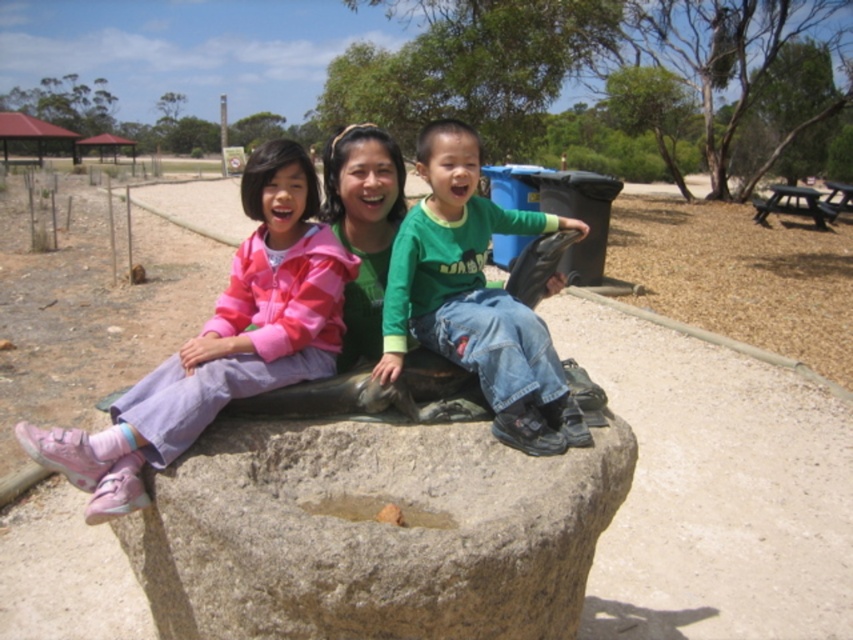
Which is below, pink fleece jacket at left or green cotton shirt at center?

pink fleece jacket at left is below.

Is pink fleece jacket at left bigger than green cotton shirt at center?

Correct, pink fleece jacket at left is larger in size than green cotton shirt at center.

Where is `pink fleece jacket at left`? This screenshot has height=640, width=853. pink fleece jacket at left is located at coordinates (222, 340).

Can you confirm if smooth stone boulder at center is positioned above pink fleece jacket at left?

Actually, smooth stone boulder at center is below pink fleece jacket at left.

Can you confirm if smooth stone boulder at center is smaller than pink fleece jacket at left?

Correct, smooth stone boulder at center occupies less space than pink fleece jacket at left.

Does point (552, 525) come behind point (322, 266)?

No.

Identify the location of smooth stone boulder at center. This screenshot has height=640, width=853. (372, 532).

Which is behind, point (537, 573) or point (567, 401)?

The point (567, 401) is behind.

Can you confirm if smooth stone boulder at center is positioned to the right of green cotton shirt at center?

Incorrect, smooth stone boulder at center is not on the right side of green cotton shirt at center.

Locate an element on the screen. smooth stone boulder at center is located at coordinates (372, 532).